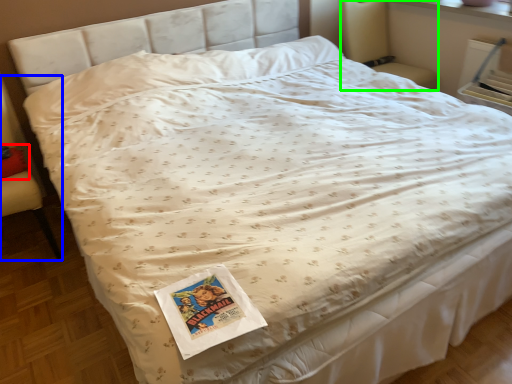
Question: Which object is positioned closest to pillow (highlighted by a red box)? Select from armchair (highlighted by a blue box) and armchair (highlighted by a green box).

Choices:
 (A) armchair
 (B) armchair

Answer: (A)